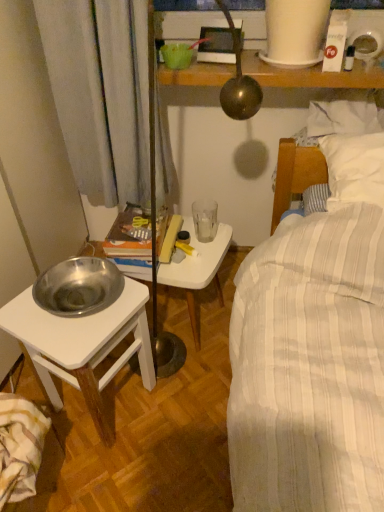
This screenshot has height=512, width=384. I want to click on vacant area that lies to the right of striped cotton blanket at lower left, so click(x=99, y=478).